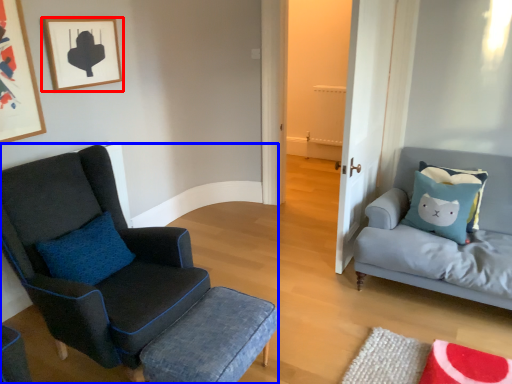
Question: Which object appears closest to the camera in this image, picture frame (highlighted by a red box) or chair (highlighted by a blue box)?

Choices:
 (A) picture frame
 (B) chair

Answer: (B)